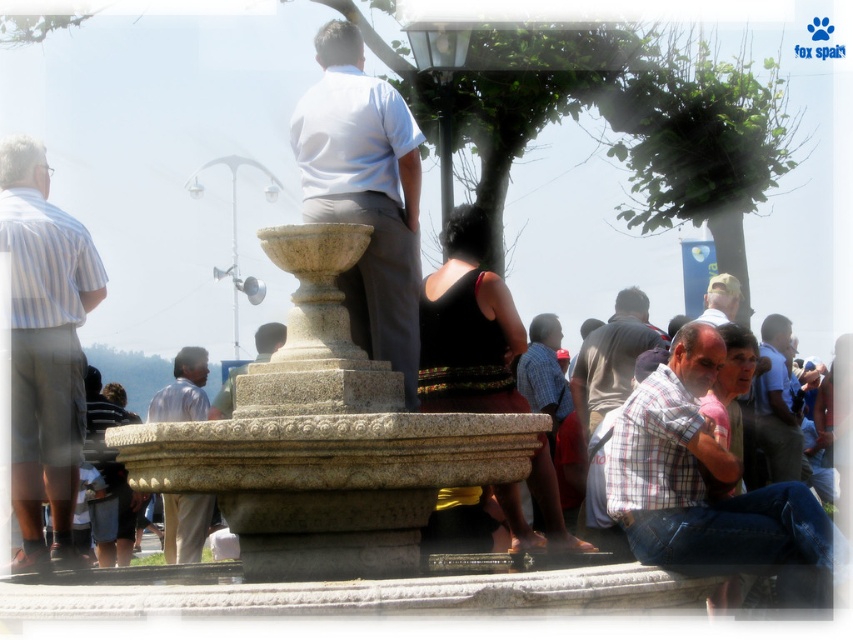
Question: Among these objects, which one is nearest to the camera?

Choices:
 (A) striped cotton shirt at left
 (B) smooth stone statue at center
 (C) matte yellow cap at center
 (D) black fabric dress at center

Answer: (D)

Question: Estimate the real-world distances between objects in this image. Which object is farther from the granite fountain at center?

Choices:
 (A) plaid fabric shirt at lower right
 (B) black fabric dress at center

Answer: (A)

Question: Can you confirm if plaid cotton shirt at lower right is positioned to the left of striped cotton shirt at left?

Choices:
 (A) yes
 (B) no

Answer: (B)

Question: Does light blue shirt at right appear under smooth stone statue at center?

Choices:
 (A) no
 (B) yes

Answer: (B)

Question: Considering the real-world distances, which object is farthest from the white cotton shirt at center?

Choices:
 (A) smooth stone statue at center
 (B) striped cotton shirt at left
 (C) plaid fabric shirt at lower right

Answer: (A)

Question: Is granite fountain at center to the left of plaid fabric shirt at lower right from the viewer's perspective?

Choices:
 (A) no
 (B) yes

Answer: (B)